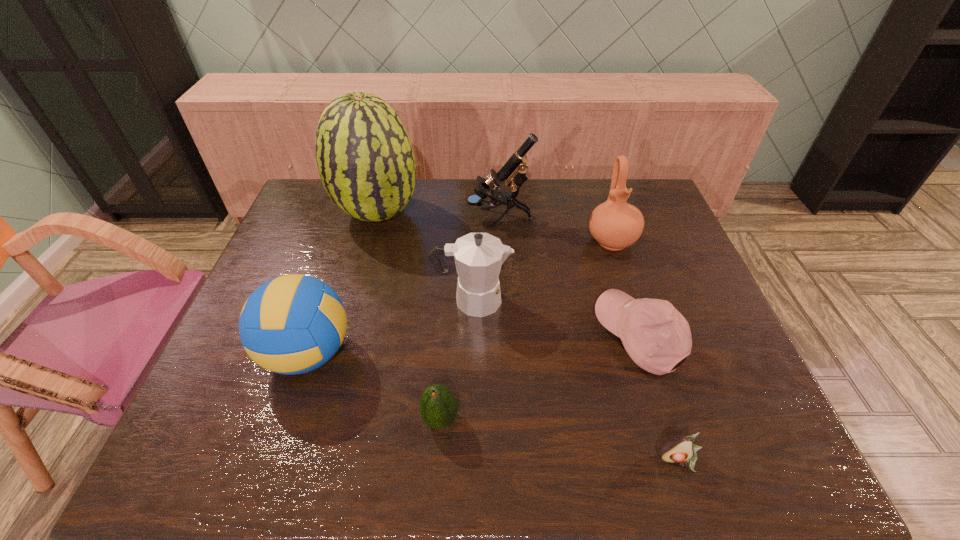
You are a GUI agent. You are given a task and a screenshot of the screen. Output one action in this format:
    pyautogui.click(x=<x>, y=<y>)
    Task: Click on the tallest object
    This screenshot has width=960, height=540.
    Given the screenshot: What is the action you would take?
    pyautogui.click(x=365, y=159)

Where is `microscope`? The image size is (960, 540). microscope is located at coordinates (514, 170).

Where is `pottery`? The width and height of the screenshot is (960, 540). pottery is located at coordinates (614, 224).

The image size is (960, 540). I want to click on coffeepot, so click(x=478, y=257).

Where is `volleyball`? volleyball is located at coordinates (292, 324).

Locate an element on the screen. baseball cap is located at coordinates (656, 336).

Where is `the second nearest object`? The image size is (960, 540). the second nearest object is located at coordinates (438, 406).

Where is `the left avocado`? The width and height of the screenshot is (960, 540). the left avocado is located at coordinates coord(438,406).

You are a GUI agent. You are given a task and a screenshot of the screen. Output one action in this format:
    pyautogui.click(x=<x>, y=<y>)
    Task: Click on the right avocado
    
    Given the screenshot: What is the action you would take?
    pos(678,449)

Image resolution: width=960 pixels, height=540 pixels. What are the coordinates of `the nearer avocado` in the screenshot? It's located at (678, 449).